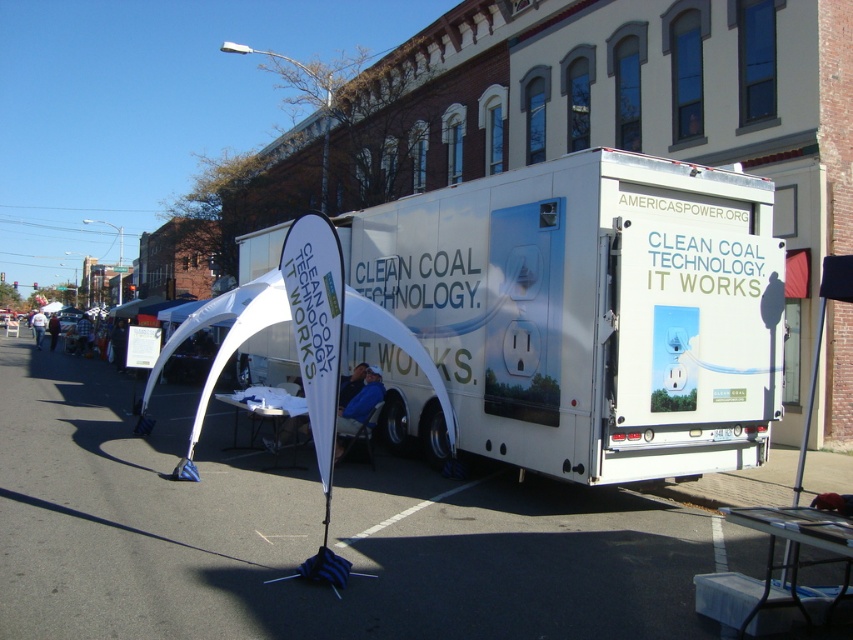
Question: Which is nearer to the white fabric banner at center?

Choices:
 (A) white fabric canopy at center
 (B) white paper at center

Answer: (A)

Question: Is white vinyl trailer at center thinner than white fabric canopy at center?

Choices:
 (A) no
 (B) yes

Answer: (B)

Question: Can you confirm if white vinyl trailer at center is positioned to the right of white fabric canopy at center?

Choices:
 (A) yes
 (B) no

Answer: (A)

Question: Which object appears farthest from the camera in this image?

Choices:
 (A) white paper at center
 (B) white fabric canopy at center
 (C) white vinyl trailer at center
 (D) white fabric banner at center

Answer: (A)

Question: Which of these objects is positioned closest to the white fabric canopy at center?

Choices:
 (A) white paper at center
 (B) white vinyl trailer at center
 (C) white fabric banner at center

Answer: (C)

Question: Can you confirm if white fabric canopy at center is positioned above white paper at center?

Choices:
 (A) no
 (B) yes

Answer: (A)